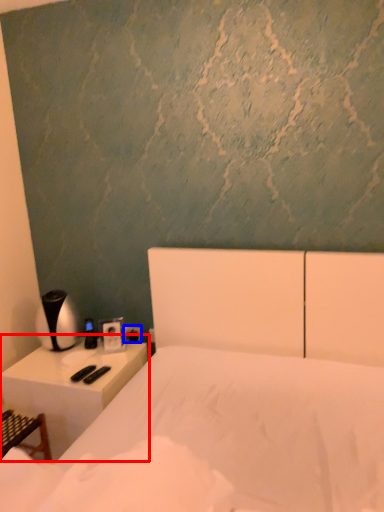
Question: Which point is closer to the camera, nightstand (highlighted by a red box) or electric outlet (highlighted by a blue box)?

Choices:
 (A) nightstand
 (B) electric outlet

Answer: (A)